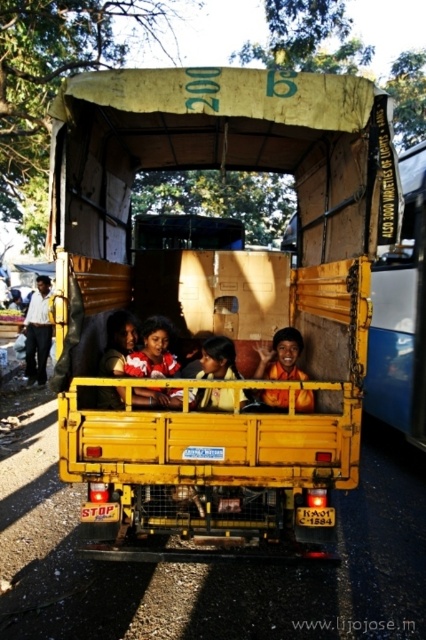
Question: Is yellow matte truck at center in front of matte yellow shirt at center?

Choices:
 (A) yes
 (B) no

Answer: (A)

Question: Does yellow matte truck at center appear under matte yellow shirt at center?

Choices:
 (A) yes
 (B) no

Answer: (B)

Question: Among these points, which one is farthest from the camera?

Choices:
 (A) (215, 346)
 (B) (296, 355)

Answer: (B)

Question: Can you confirm if yellow matte truck at center is thinner than red and white striped shirt at center?

Choices:
 (A) yes
 (B) no

Answer: (B)

Question: Which point is farther from the camera taking this photo?

Choices:
 (A) (158, 365)
 (B) (224, 369)

Answer: (A)

Question: Which of the following is the closest to the observer?

Choices:
 (A) (296, 352)
 (B) (195, 508)
 (C) (169, 326)

Answer: (B)